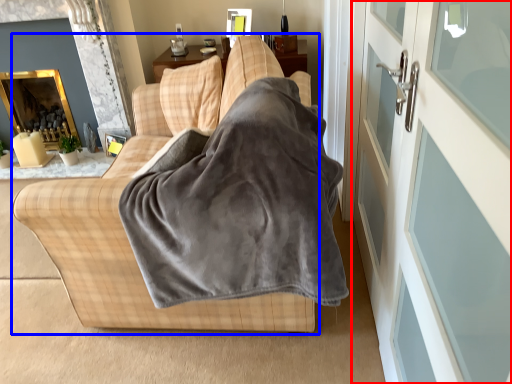
Question: Which of the following is the closest to the observer, screen door (highlighted by a red box) or studio couch (highlighted by a blue box)?

Choices:
 (A) screen door
 (B) studio couch

Answer: (A)